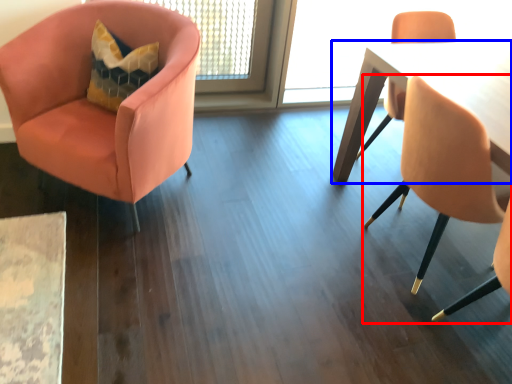
Question: Which object appears closest to the camera in this image, chair (highlighted by a red box) or table (highlighted by a blue box)?

Choices:
 (A) chair
 (B) table

Answer: (A)